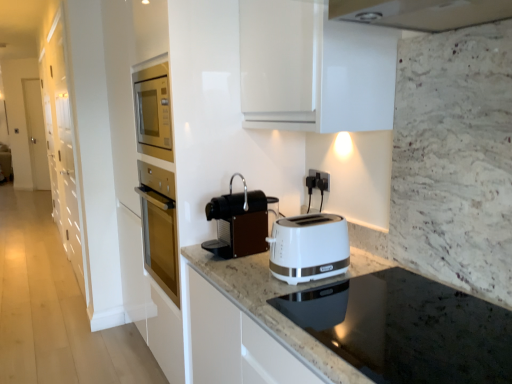
Where is `free spot above white plastic toaster at center (from a real-world perspective)`? The image size is (512, 384). free spot above white plastic toaster at center (from a real-world perspective) is located at coordinates (298, 218).